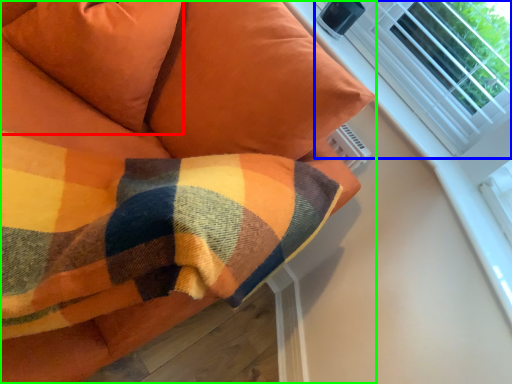
Question: Which object is the farthest from pillow (highlighted by a red box)? Choose among these: bay window (highlighted by a blue box) or furniture (highlighted by a green box).

Choices:
 (A) bay window
 (B) furniture

Answer: (A)